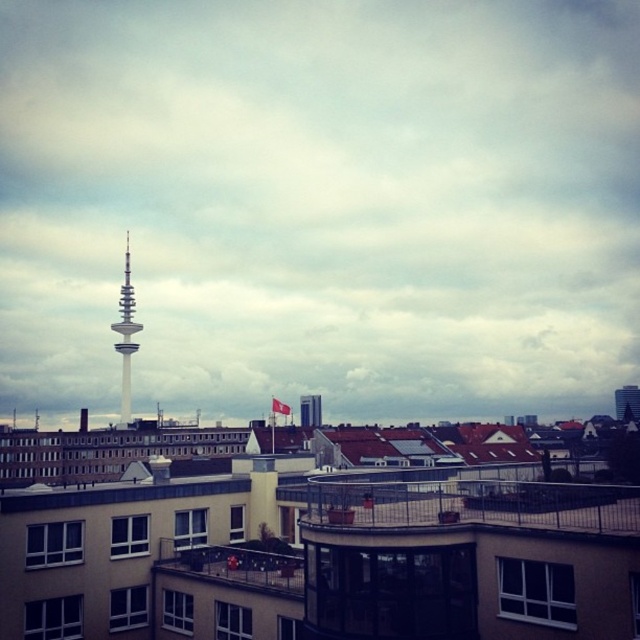
Between silver metallic tower at center and white glass tv tower at center, which one is positioned lower?

white glass tv tower at center is lower down.

Which is above, silver metallic tower at center or white glass tv tower at center?

Positioned higher is silver metallic tower at center.

Is point (132, 296) behind point (316, 403)?

No, it is not.

Identify the location of silver metallic tower at center. The width and height of the screenshot is (640, 640). (125, 336).